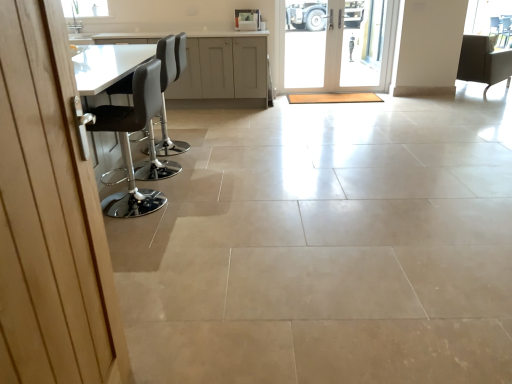
Identify the location of free point behind white leather bar stool at left, the third chair positioned from the right. (188, 133).